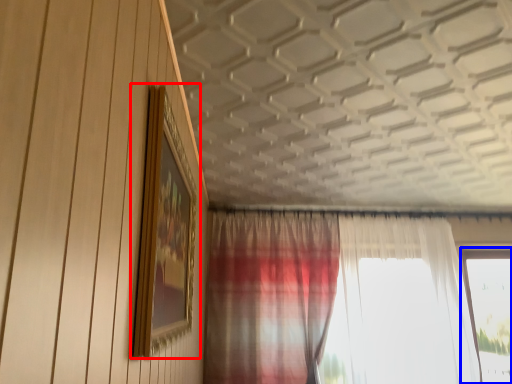
Question: Which point is further to the camera, picture frame (highlighted by a red box) or window (highlighted by a blue box)?

Choices:
 (A) picture frame
 (B) window

Answer: (B)